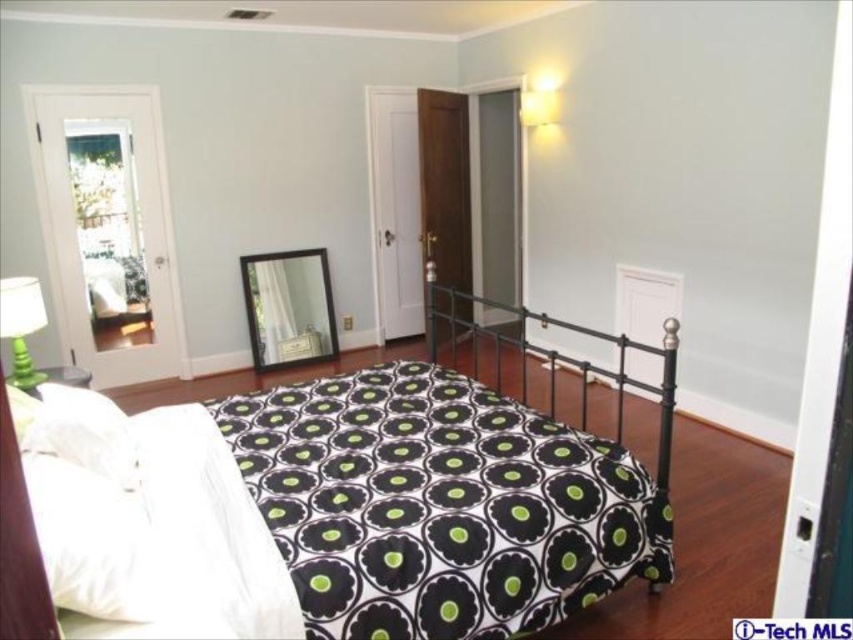
You are an interior designer assessing the bedroom layout. You need to determine if the black matte bed at center can be moved closer to the matte white lampshade at upper right without removing any furniture. Based on their sizes, can the bed be moved closer?

The black matte bed at center is bigger than the matte white lampshade at upper right, so moving it closer may be challenging due to its larger size, but the exact feasibility depends on available space not specified here.

You are standing in the bedroom and want to place a new painting on the wall. The painting is 1 meter wide. You need to ensure it fits between the black matte bed at center and the matte white lampshade at upper right. Can you determine if the painting will fit?

The black matte bed at center is closer to the viewer than the matte white lampshade at upper right, so the distance between them isn not specified. However, since the painting is 1 meter wide, it might fit depending on the actual spacing between the objects. Without exact measurements, it is uncertain.